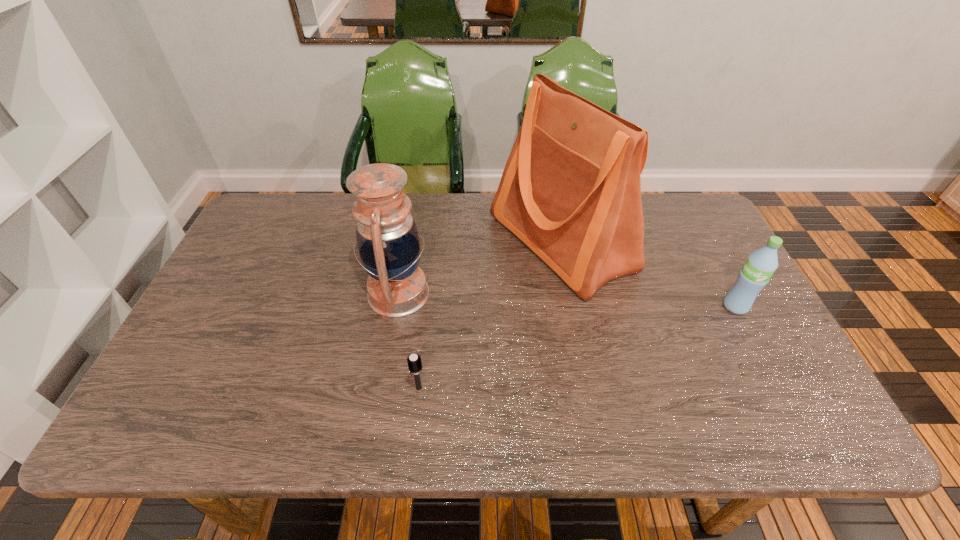
The height and width of the screenshot is (540, 960). In order to click on free spot between the hairbrush and the second object from right to left in this screenshot , I will do `click(490, 315)`.

I want to click on empty space that is in between the second tallest object and the rightmost object, so click(566, 300).

Locate an element on the screen. This screenshot has width=960, height=540. free space that is in between the third shortest object and the second shortest object is located at coordinates (566, 300).

You are a GUI agent. You are given a task and a screenshot of the screen. Output one action in this format:
    pyautogui.click(x=<x>, y=<y>)
    Task: Click on the blank region between the shortest object and the shopping bag
    
    Given the screenshot: What is the action you would take?
    pyautogui.click(x=490, y=315)

Where is `free space between the third shortest object and the rightmost object`? free space between the third shortest object and the rightmost object is located at coordinates (566, 300).

Where is `vacant space that is in between the water bottle and the oil lamp`? The image size is (960, 540). vacant space that is in between the water bottle and the oil lamp is located at coordinates (566, 300).

In order to click on vacant space that is in between the shortest object and the second object from right to left in this screenshot , I will do `click(490, 315)`.

Identify the location of unoccupied area between the nearest object and the rightmost object. (577, 347).

I want to click on object that is the second closest to the water bottle, so click(387, 237).

At what (x,y) coordinates should I click in order to perform the action: click on object that is the closest to the third object from left to right. Please return your answer as a coordinate pair (x, y). Image resolution: width=960 pixels, height=540 pixels. Looking at the image, I should click on (387, 237).